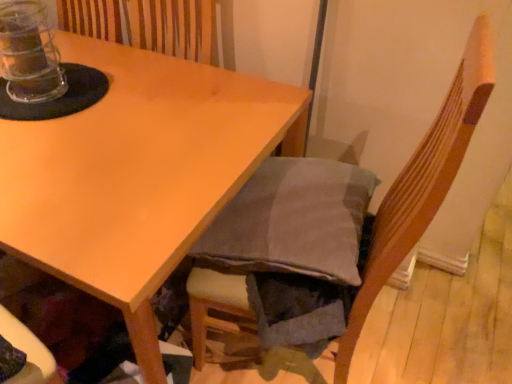
Where is `free space above matte wood table at upper left (from a real-world perspective)`? The height and width of the screenshot is (384, 512). free space above matte wood table at upper left (from a real-world perspective) is located at coordinates (111, 114).